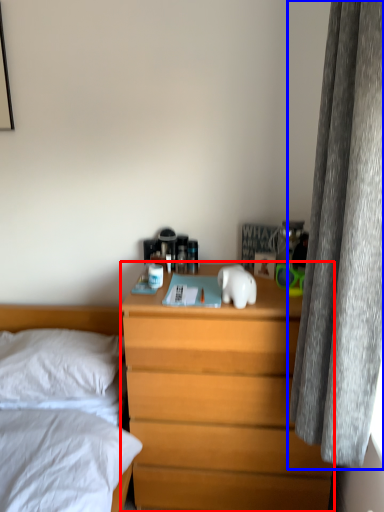
Question: Which of the following is the closest to the observer, nightstand (highlighted by a red box) or curtain (highlighted by a blue box)?

Choices:
 (A) nightstand
 (B) curtain

Answer: (B)